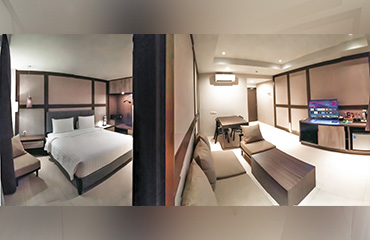
Locate an element on the screen. couch is located at coordinates (233, 174).